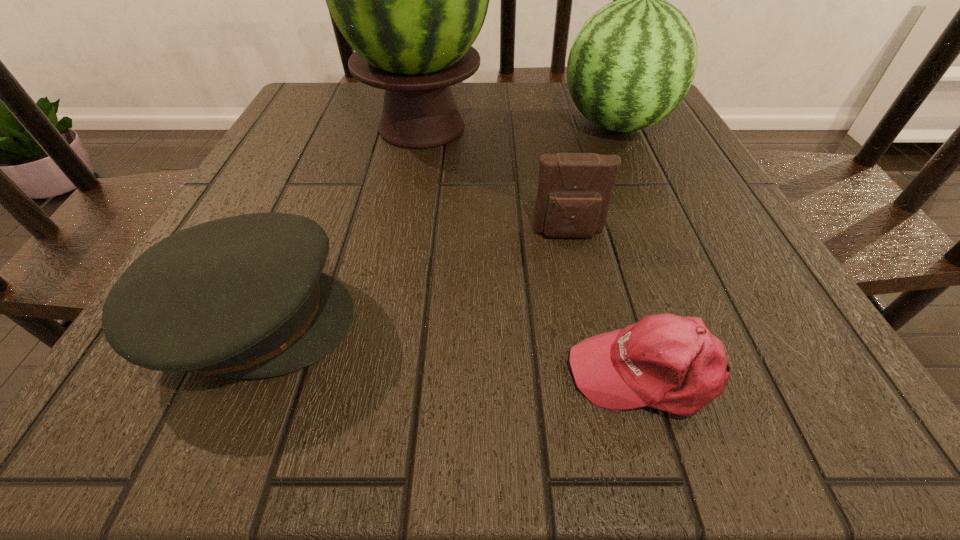
Find the location of `object present at the far left corner`. object present at the far left corner is located at coordinates (411, 0).

Identify the location of object present at the near left corner. The image size is (960, 540). (244, 296).

You are a GUI agent. You are given a task and a screenshot of the screen. Output one action in this format:
    pyautogui.click(x=<x>, y=<y>)
    Task: Click on the object that is at the far right corner
    This screenshot has height=540, width=960.
    Given the screenshot: What is the action you would take?
    pyautogui.click(x=633, y=61)

Find the location of `object present at the near right corner`. object present at the near right corner is located at coordinates (672, 363).

The height and width of the screenshot is (540, 960). In the image, there is a desktop. In order to click on free region at the far edge in this screenshot , I will do `click(518, 102)`.

Where is `free space at the near edge of the desktop`? The image size is (960, 540). free space at the near edge of the desktop is located at coordinates (294, 376).

Image resolution: width=960 pixels, height=540 pixels. What are the coordinates of `vacant region at the left edge of the desktop` in the screenshot? It's located at pos(247,210).

In order to click on free region at the right edge of the desktop in this screenshot , I will do `click(754, 262)`.

Locate an element on the screen. vacant space at the far left corner of the desktop is located at coordinates (324, 108).

Image resolution: width=960 pixels, height=540 pixels. Find the location of `vacant space at the near left corner of the desktop`. vacant space at the near left corner of the desktop is located at coordinates (126, 432).